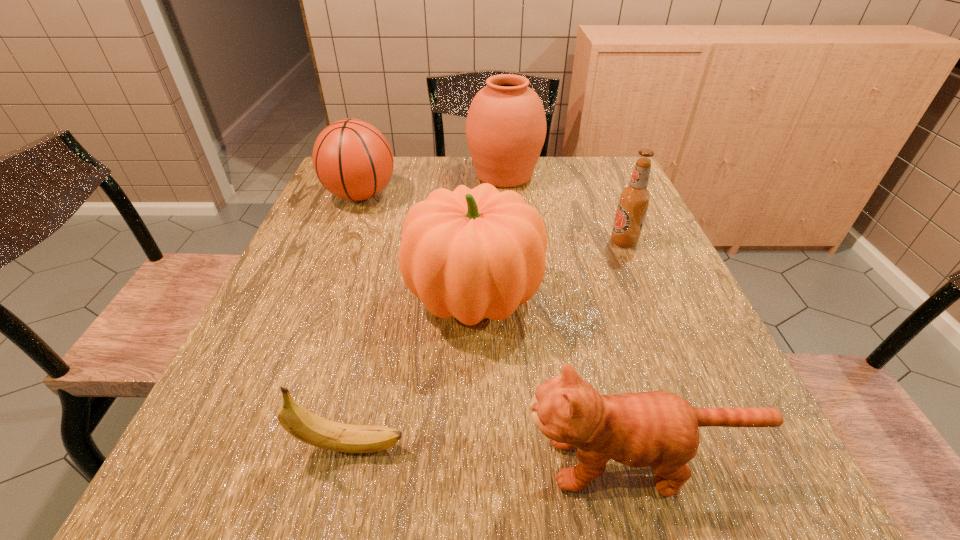
Identify the location of vacant area at the near right corner of the desktop. (756, 459).

Locate an element on the screen. This screenshot has height=540, width=960. blank region between the beer bottle and the pumpkin is located at coordinates (549, 270).

The image size is (960, 540). Identify the location of blank region between the cat and the shortest object. (493, 454).

Find the location of `free point between the urn and the fourth nearest object`. free point between the urn and the fourth nearest object is located at coordinates (564, 208).

Where is `free point between the urn and the third farthest object`? free point between the urn and the third farthest object is located at coordinates (564, 208).

At what (x,y) coordinates should I click in order to perform the action: click on unoccupied position between the shortest object and the urn. Please return your answer as a coordinate pair (x, y). Image resolution: width=960 pixels, height=540 pixels. Looking at the image, I should click on (427, 310).

Identify the location of unoccupied area between the urn and the banana. The width and height of the screenshot is (960, 540). (427, 310).

At what (x,y) coordinates should I click in order to perform the action: click on free space between the beer bottle and the urn. Please return your answer as a coordinate pair (x, y). Image resolution: width=960 pixels, height=540 pixels. Looking at the image, I should click on (564, 208).

Locate which object is the fourth closest to the pumpkin. Please provide its 2D coordinates. Your answer should be formatted as a tuple, i.e. [(x, y)], where the tuple contains the x and y coordinates of a point satisfying the conditions above.

[(634, 199)]

Select which object is the closest to the pumpkin. Please provide its 2D coordinates. Your answer should be formatted as a tuple, i.e. [(x, y)], where the tuple contains the x and y coordinates of a point satisfying the conditions above.

[(659, 429)]